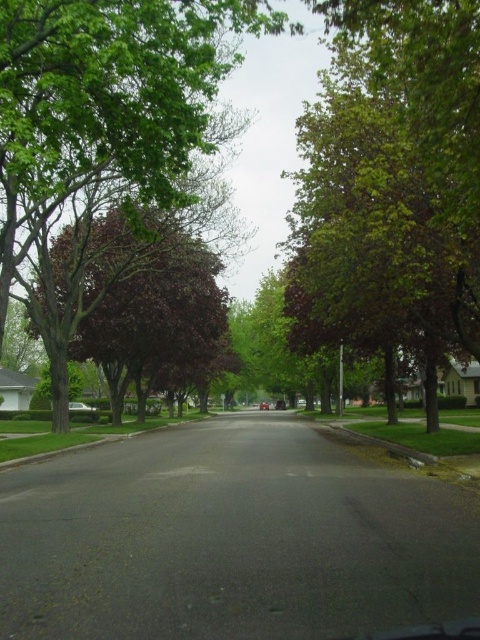
Is green leafy tree at center positioned before white glossy car at center?

That is True.

Which is behind, point (155, 173) or point (88, 406)?

Point (88, 406)

Identify the location of green leafy tree at center. This screenshot has width=480, height=640. (107, 100).

What do you see at coordinates (107, 100) in the screenshot? I see `green leafy tree at center` at bounding box center [107, 100].

Which of these two, green leafy tree at center or metallic red car at center, stands shorter?

Standing shorter between the two is metallic red car at center.

Identify the location of green leafy tree at center. The height and width of the screenshot is (640, 480). (107, 100).

Can you confirm if white glossy car at center is shorter than metallic red car at center?

No.

Which of these two, white glossy car at center or metallic red car at center, stands taller?

Standing taller between the two is white glossy car at center.

Locate an element on the screen. white glossy car at center is located at coordinates (81, 406).